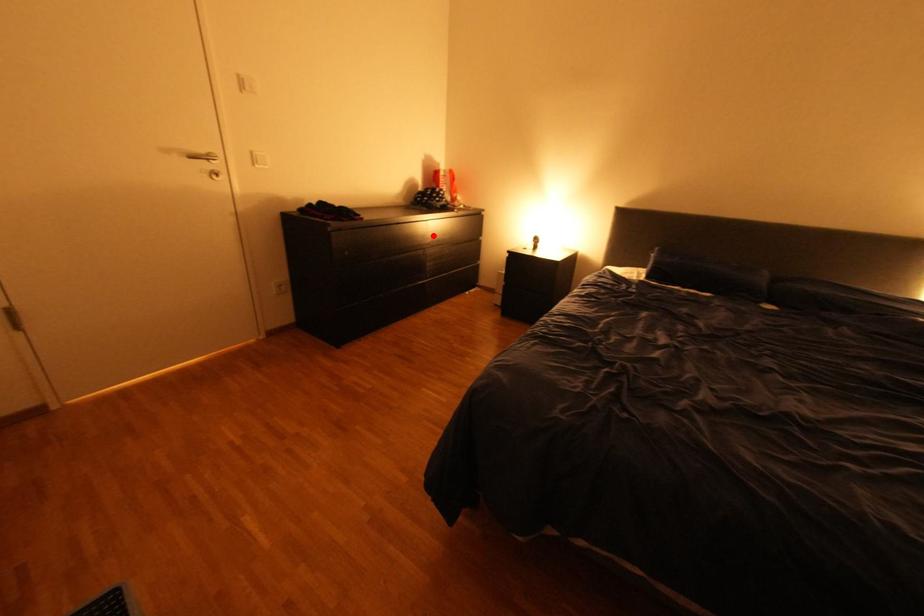
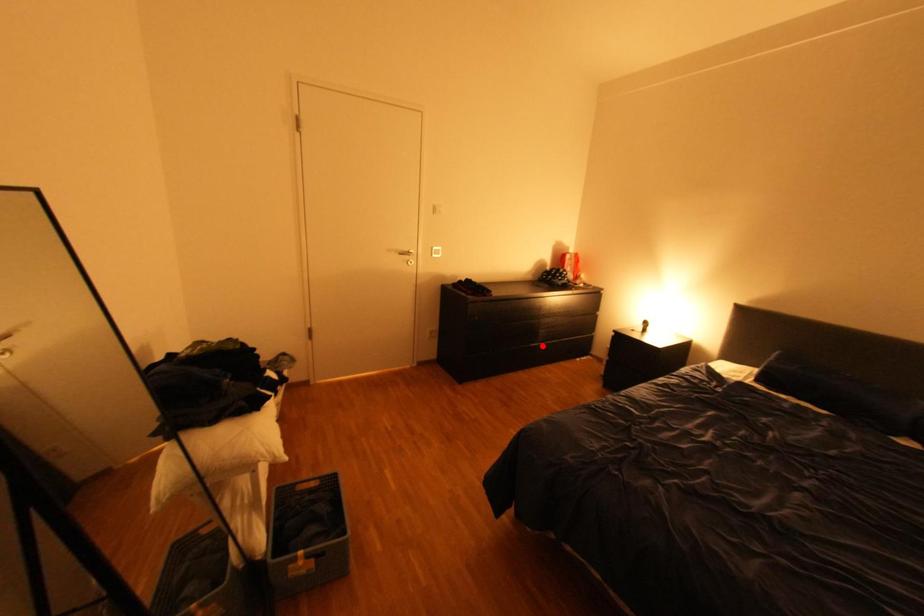
I am providing you with two images of the same scene from different viewpoints. A red point is marked on the first image and another point is marked on the second image. Is the red point in image1 aligned with the point shown in image2?

→ No